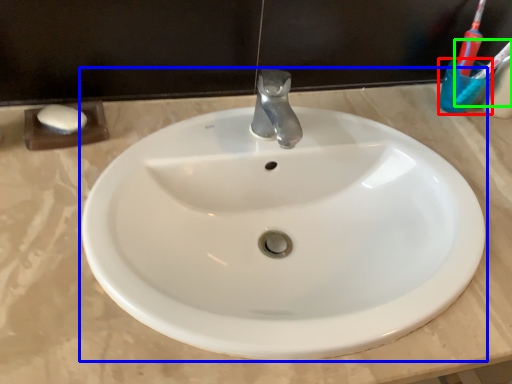
Question: Estimate the real-world distances between objects in this image. Which object is farther from liquid (highlighted by a red box), sink (highlighted by a blue box) or toothbrush (highlighted by a green box)?

Choices:
 (A) sink
 (B) toothbrush

Answer: (A)